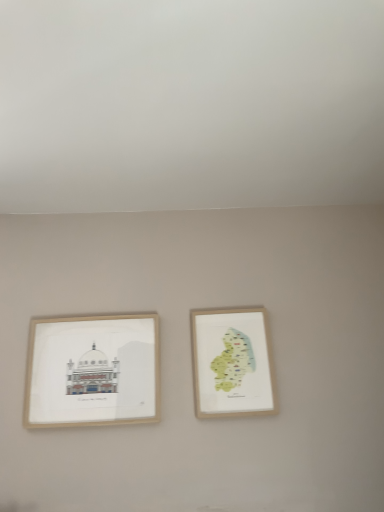
Question: Considering the relative sizes of wooden picture frame at left, arranged as the 2th picture frame when viewed from the right, and wooden map at center right, the second picture frame positioned from the left, in the image provided, is wooden picture frame at left, arranged as the 2th picture frame when viewed from the right, smaller than wooden map at center right, the second picture frame positioned from the left,?

Choices:
 (A) no
 (B) yes

Answer: (A)

Question: Is wooden picture frame at left, marked as the first picture frame in a left-to-right arrangement, to the left of wooden map at center right, the second picture frame positioned from the left, from the viewer's perspective?

Choices:
 (A) no
 (B) yes

Answer: (B)

Question: Does wooden picture frame at left, arranged as the 2th picture frame when viewed from the right, have a larger size compared to wooden map at center right, the second picture frame positioned from the left?

Choices:
 (A) no
 (B) yes

Answer: (B)

Question: Is wooden picture frame at left, marked as the first picture frame in a left-to-right arrangement, facing towards wooden map at center right, the 1th picture frame from the right?

Choices:
 (A) no
 (B) yes

Answer: (A)

Question: Does wooden picture frame at left, marked as the first picture frame in a left-to-right arrangement, have a greater width compared to wooden map at center right, the second picture frame positioned from the left?

Choices:
 (A) no
 (B) yes

Answer: (B)

Question: From a real-world perspective, does wooden picture frame at left, arranged as the 2th picture frame when viewed from the right, sit lower than wooden map at center right, the second picture frame positioned from the left?

Choices:
 (A) no
 (B) yes

Answer: (B)

Question: From a real-world perspective, is wooden map at center right, the 1th picture frame from the right, over wooden picture frame at left, arranged as the 2th picture frame when viewed from the right?

Choices:
 (A) no
 (B) yes

Answer: (B)

Question: Can you see wooden map at center right, the second picture frame positioned from the left, touching wooden picture frame at left, arranged as the 2th picture frame when viewed from the right?

Choices:
 (A) no
 (B) yes

Answer: (A)

Question: From the image's perspective, is wooden map at center right, the second picture frame positioned from the left, on top of wooden picture frame at left, marked as the first picture frame in a left-to-right arrangement?

Choices:
 (A) no
 (B) yes

Answer: (B)

Question: Is wooden map at center right, the 1th picture frame from the right, positioned with its back to wooden picture frame at left, arranged as the 2th picture frame when viewed from the right?

Choices:
 (A) no
 (B) yes

Answer: (A)

Question: Is wooden map at center right, the second picture frame positioned from the left, closer to camera compared to wooden picture frame at left, marked as the first picture frame in a left-to-right arrangement?

Choices:
 (A) yes
 (B) no

Answer: (B)

Question: Considering the relative positions of wooden map at center right, the 1th picture frame from the right, and wooden picture frame at left, marked as the first picture frame in a left-to-right arrangement, in the image provided, is wooden map at center right, the 1th picture frame from the right, behind wooden picture frame at left, marked as the first picture frame in a left-to-right arrangement,?

Choices:
 (A) yes
 (B) no

Answer: (A)

Question: From a real-world perspective, is wooden picture frame at left, arranged as the 2th picture frame when viewed from the right, above or below wooden map at center right, the second picture frame positioned from the left?

Choices:
 (A) below
 (B) above

Answer: (A)